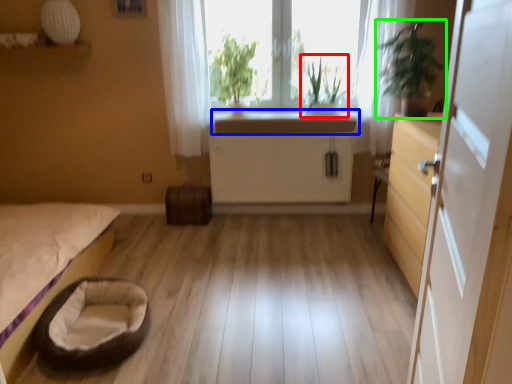
Question: Considering the real-world distances, which object is closest to plant (highlighted by a red box)? counter top (highlighted by a blue box) or houseplant (highlighted by a green box).

Choices:
 (A) counter top
 (B) houseplant

Answer: (A)